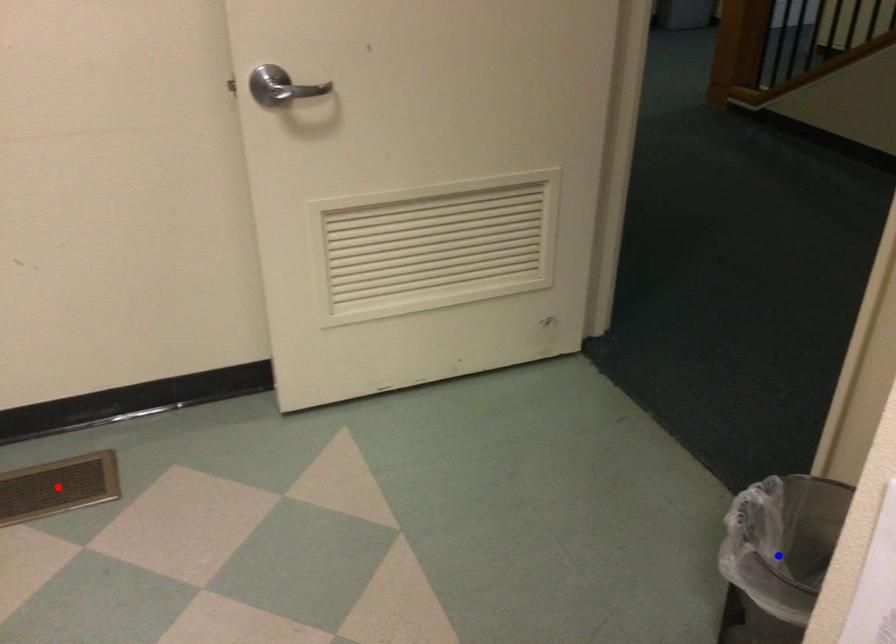
Question: Which of the two points in the image is closer to the camera?

Choices:
 (A) Blue point is closer.
 (B) Red point is closer.

Answer: (A)